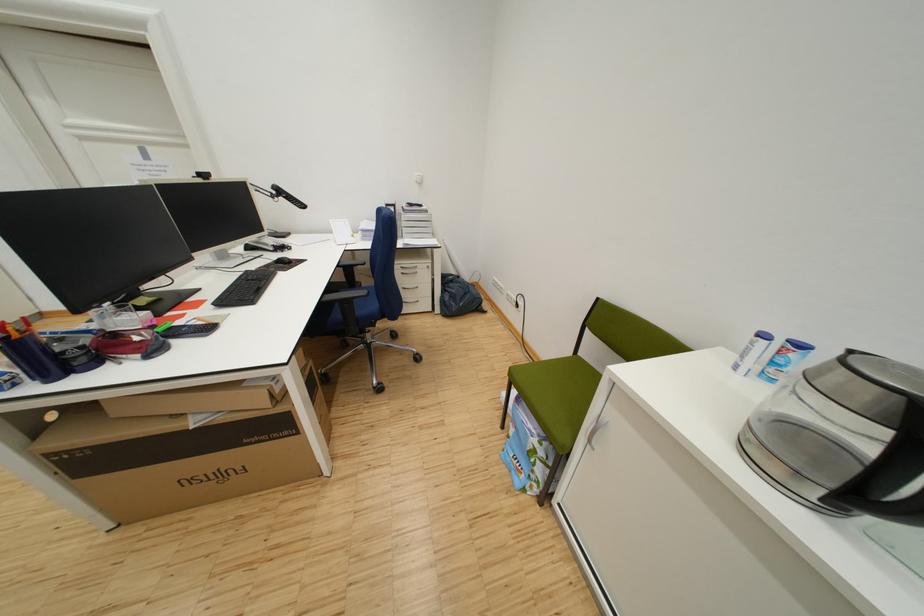
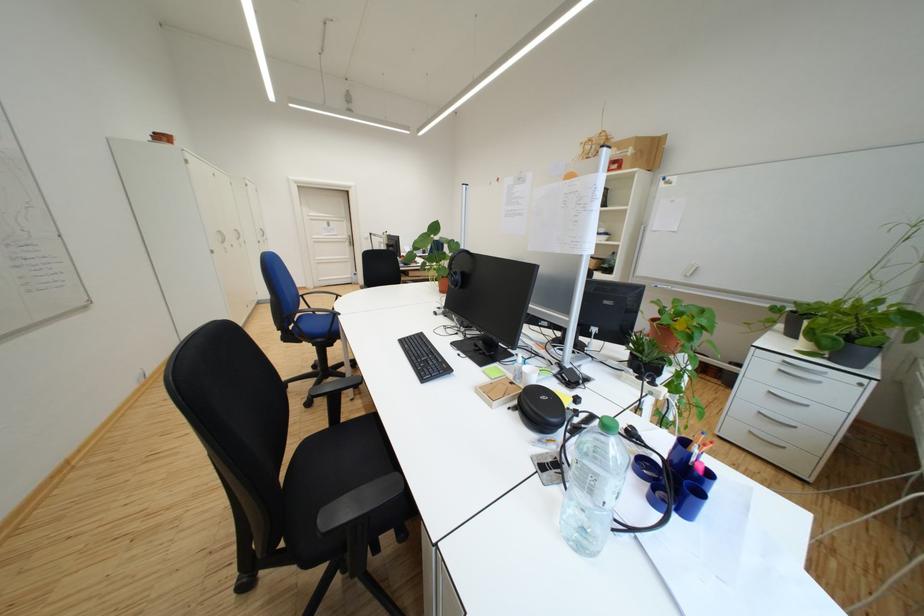
From the picture: What movement of the cameraman would produce the second image?

The cameraman moved toward left, backward.